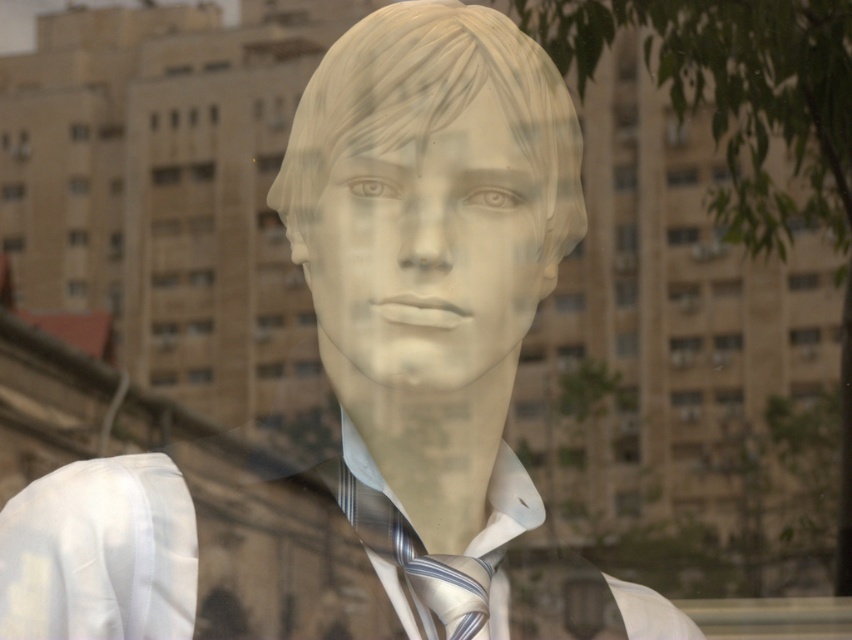
Does matte white mannequin head at center lie behind white silk dress shirt at center?

No, matte white mannequin head at center is in front of white silk dress shirt at center.

What do you see at coordinates (430, 237) in the screenshot? I see `matte white mannequin head at center` at bounding box center [430, 237].

Locate an element on the screen. matte white mannequin head at center is located at coordinates (430, 237).

Who is taller, matte white mannequin head at center or striped silk tie at center?

Standing taller between the two is matte white mannequin head at center.

Is point (398, 193) behind point (436, 618)?

No, (398, 193) is closer to viewer.

Find the location of `matte white mannequin head at center`. matte white mannequin head at center is located at coordinates (430, 237).

Is white matte mannequin head at center further to camera compared to striped silk tie at center?

That is False.

Is point (450, 144) positioned behind point (436, 612)?

No, (450, 144) is in front of (436, 612).

The image size is (852, 640). Describe the element at coordinates (429, 256) in the screenshot. I see `white matte mannequin head at center` at that location.

Identify the location of white matte mannequin head at center. (429, 256).